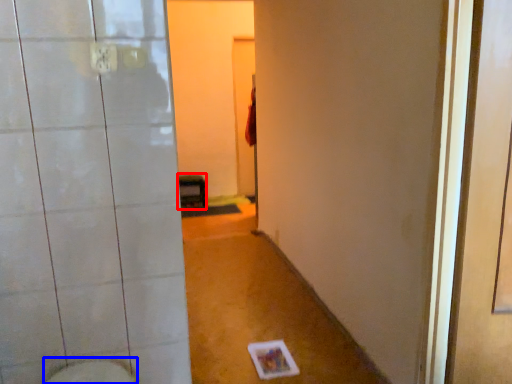
Question: Among these objects, which one is farthest to the camera, furniture (highlighted by a red box) or bidet (highlighted by a blue box)?

Choices:
 (A) furniture
 (B) bidet

Answer: (A)